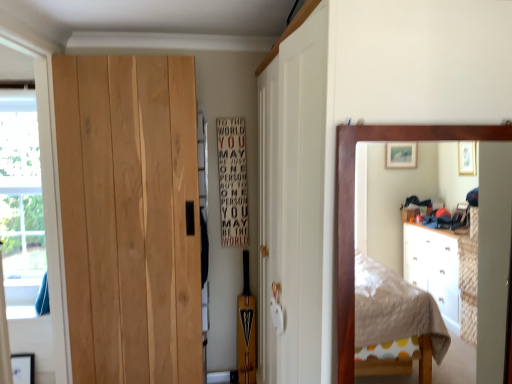
Question: Does white wood sign at center lie behind transparent plastic window screen at left?

Choices:
 (A) no
 (B) yes

Answer: (A)

Question: Is white wood sign at center positioned beyond the bounds of transparent plastic window screen at left?

Choices:
 (A) yes
 (B) no

Answer: (A)

Question: Considering the relative sizes of white wood sign at center and transparent plastic window screen at left in the image provided, is white wood sign at center thinner than transparent plastic window screen at left?

Choices:
 (A) no
 (B) yes

Answer: (B)

Question: Can you confirm if white wood sign at center is positioned to the right of transparent plastic window screen at left?

Choices:
 (A) no
 (B) yes

Answer: (B)

Question: Does white wood sign at center have a greater width compared to transparent plastic window screen at left?

Choices:
 (A) yes
 (B) no

Answer: (B)

Question: From the image's perspective, does white wood sign at center appear lower than transparent plastic window screen at left?

Choices:
 (A) yes
 (B) no

Answer: (B)

Question: Considering the relative sizes of transparent plastic window screen at left and wooden mirror at right in the image provided, is transparent plastic window screen at left bigger than wooden mirror at right?

Choices:
 (A) no
 (B) yes

Answer: (B)

Question: From a real-world perspective, does transparent plastic window screen at left sit lower than wooden mirror at right?

Choices:
 (A) yes
 (B) no

Answer: (A)

Question: Does transparent plastic window screen at left come in front of wooden mirror at right?

Choices:
 (A) no
 (B) yes

Answer: (A)

Question: Can you confirm if transparent plastic window screen at left is thinner than wooden mirror at right?

Choices:
 (A) no
 (B) yes

Answer: (A)

Question: Is transparent plastic window screen at left looking in the opposite direction of wooden mirror at right?

Choices:
 (A) yes
 (B) no

Answer: (B)

Question: Does transparent plastic window screen at left have a smaller size compared to wooden mirror at right?

Choices:
 (A) yes
 (B) no

Answer: (B)

Question: Does transparent plastic window screen at left have a larger size compared to natural wood door at left?

Choices:
 (A) yes
 (B) no

Answer: (B)